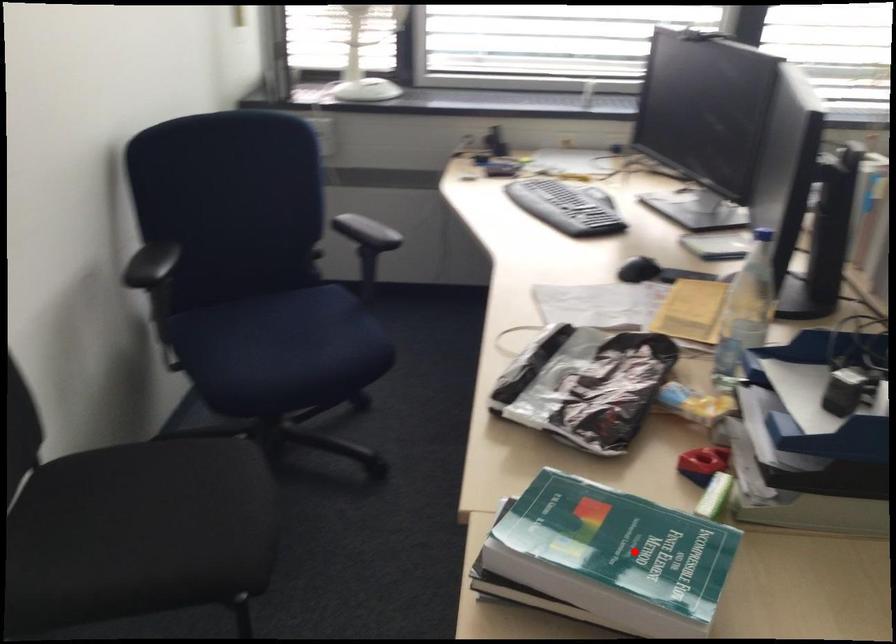
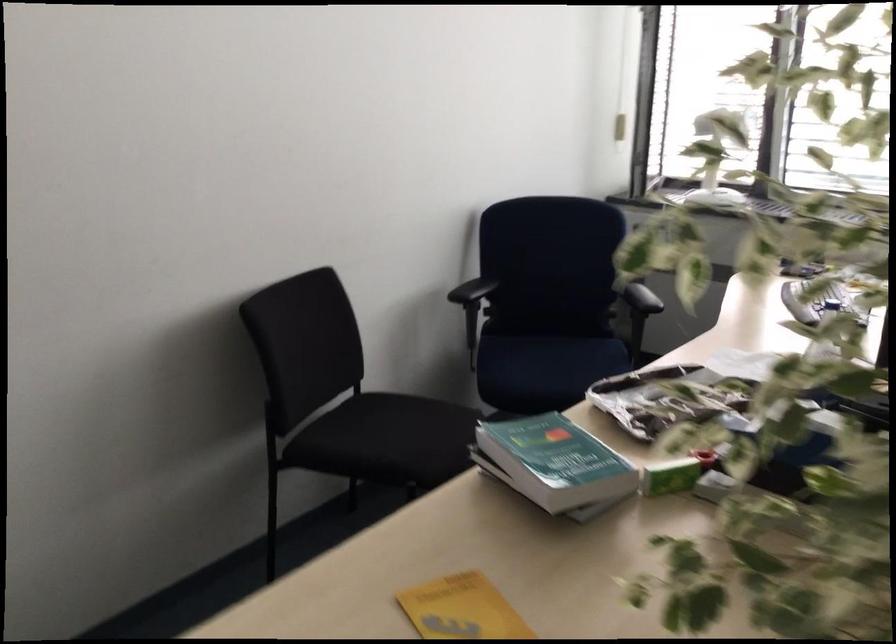
Question: I am providing you with two images of the same scene from different viewpoints. In image1, a red point is highlighted. Considering the same 3D point in image2, which of the following is correct?

Choices:
 (A) It is closer
 (B) It is farther

Answer: (B)